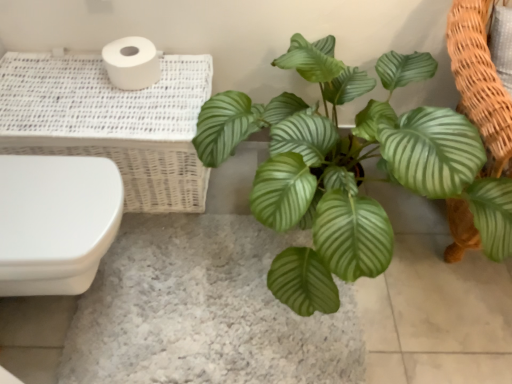
Question: Is white glossy toilet at left to the left or to the right of white wicker basket at upper left in the image?

Choices:
 (A) right
 (B) left

Answer: (B)

Question: Considering the positions of white glossy toilet at left and white wicker basket at upper left in the image, is white glossy toilet at left wider or thinner than white wicker basket at upper left?

Choices:
 (A) wide
 (B) thin

Answer: (A)

Question: Which of these objects is positioned farthest from the white matte toilet paper at upper left?

Choices:
 (A) green glossy leafy plant at center
 (B) white glossy toilet at left
 (C) green leafy plant at center
 (D) white wicker basket at upper left

Answer: (C)

Question: Which object is the closest to the white matte toilet paper at upper left?

Choices:
 (A) white glossy toilet at left
 (B) green glossy leafy plant at center
 (C) white wicker basket at upper left
 (D) green leafy plant at center

Answer: (C)